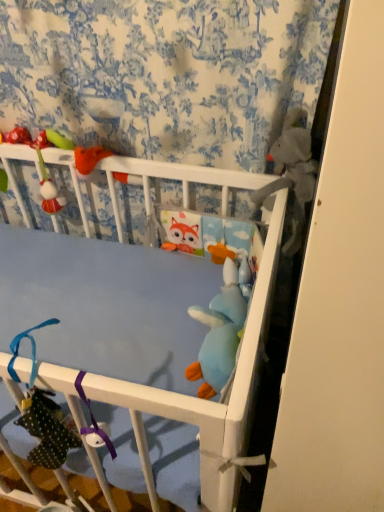
Measure the distance between point [46,141] and camera.

Point [46,141] is 1.09 meters from camera.

What do you see at coordinates (292, 173) in the screenshot? I see `gray plush toy at upper right, marked as the first toy in a right-to-left arrangement` at bounding box center [292, 173].

This screenshot has width=384, height=512. I want to click on fuzzy fabric plush at upper left, the fourth toy positioned from the right, so click(42, 162).

Does blue plush toy at center, which is the 3th toy in left-to-right order, have a greater height compared to fuzzy fabric plush at upper left, which ranks as the first toy in left-to-right order?

In fact, blue plush toy at center, which is the 3th toy in left-to-right order, may be shorter than fuzzy fabric plush at upper left, which ranks as the first toy in left-to-right order.

Is blue plush toy at center, which is the 3th toy in left-to-right order, positioned with its back to fuzzy fabric plush at upper left, which ranks as the first toy in left-to-right order?

No, blue plush toy at center, which is the 3th toy in left-to-right order, is not facing away from fuzzy fabric plush at upper left, which ranks as the first toy in left-to-right order.

Are blue plush toy at center, which is the 3th toy in left-to-right order, and fuzzy fabric plush at upper left, which ranks as the first toy in left-to-right order, located far from each other?

No, blue plush toy at center, which is the 3th toy in left-to-right order, is not far away from fuzzy fabric plush at upper left, which ranks as the first toy in left-to-right order.

Can you confirm if blue plush toy at center, acting as the 2th toy starting from the right, is thinner than fuzzy fabric plush at upper left, the fourth toy positioned from the right?

Yes, blue plush toy at center, acting as the 2th toy starting from the right, is thinner than fuzzy fabric plush at upper left, the fourth toy positioned from the right.

Is gray plush toy at upper right, which ranks as the 4th toy in left-to-right order, wider or thinner than fuzzy fabric plush at upper left, the fourth toy positioned from the right?

In the image, gray plush toy at upper right, which ranks as the 4th toy in left-to-right order, appears to be wider than fuzzy fabric plush at upper left, the fourth toy positioned from the right.

From a real-world perspective, is gray plush toy at upper right, marked as the first toy in a right-to-left arrangement, over fuzzy fabric plush at upper left, the fourth toy positioned from the right?

Yes.

Consider the image. From the image's perspective, which one is positioned lower, gray plush toy at upper right, marked as the first toy in a right-to-left arrangement, or fuzzy fabric plush at upper left, which ranks as the first toy in left-to-right order?

gray plush toy at upper right, marked as the first toy in a right-to-left arrangement, is shown below in the image.

In the scene shown: In terms of height, does gray plush toy at upper right, marked as the first toy in a right-to-left arrangement, look taller or shorter compared to fuzzy fabric plush at upper left, the fourth toy positioned from the right?

In the image, gray plush toy at upper right, marked as the first toy in a right-to-left arrangement, appears to be shorter than fuzzy fabric plush at upper left, the fourth toy positioned from the right.

Is soft blue plush toy at center, the second toy viewed from the left, taller or shorter than blue plush toy at center, acting as the 2th toy starting from the right?

Considering their sizes, soft blue plush toy at center, the second toy viewed from the left, has more height than blue plush toy at center, acting as the 2th toy starting from the right.

Are soft blue plush toy at center, the second toy viewed from the left, and blue plush toy at center, acting as the 2th toy starting from the right, beside each other?

Yes, soft blue plush toy at center, the second toy viewed from the left, is in contact with blue plush toy at center, acting as the 2th toy starting from the right.

Which is more to the right, soft blue plush toy at center, the second toy viewed from the left, or blue plush toy at center, acting as the 2th toy starting from the right?

Positioned to the right is blue plush toy at center, acting as the 2th toy starting from the right.

From a real-world perspective, between soft blue plush toy at center, which appears as the 3th toy when viewed from the right, and fuzzy fabric plush at upper left, which ranks as the first toy in left-to-right order, who is vertically lower?

In real-world perspective, soft blue plush toy at center, which appears as the 3th toy when viewed from the right, is lower.

Between soft blue plush toy at center, which appears as the 3th toy when viewed from the right, and fuzzy fabric plush at upper left, the fourth toy positioned from the right, which one is positioned behind?

fuzzy fabric plush at upper left, the fourth toy positioned from the right.

Between soft blue plush toy at center, the second toy viewed from the left, and fuzzy fabric plush at upper left, the fourth toy positioned from the right, which one has larger width?

Wider between the two is soft blue plush toy at center, the second toy viewed from the left.

Would you say soft blue plush toy at center, the second toy viewed from the left, is to the left or to the right of fuzzy fabric plush at upper left, the fourth toy positioned from the right, in the picture?

soft blue plush toy at center, the second toy viewed from the left, is positioned on fuzzy fabric plush at upper left, the fourth toy positioned from the right,'s right side.

In terms of width, does soft blue plush toy at center, the second toy viewed from the left, look wider or thinner when compared to gray plush toy at upper right, marked as the first toy in a right-to-left arrangement?

In the image, soft blue plush toy at center, the second toy viewed from the left, appears to be wider than gray plush toy at upper right, marked as the first toy in a right-to-left arrangement.

Considering the relative sizes of soft blue plush toy at center, which appears as the 3th toy when viewed from the right, and gray plush toy at upper right, marked as the first toy in a right-to-left arrangement, in the image provided, is soft blue plush toy at center, which appears as the 3th toy when viewed from the right, taller than gray plush toy at upper right, marked as the first toy in a right-to-left arrangement,?

Incorrect, the height of soft blue plush toy at center, which appears as the 3th toy when viewed from the right, is not larger of that of gray plush toy at upper right, marked as the first toy in a right-to-left arrangement.

Which is in front, soft blue plush toy at center, which appears as the 3th toy when viewed from the right, or gray plush toy at upper right, which ranks as the 4th toy in left-to-right order?

soft blue plush toy at center, which appears as the 3th toy when viewed from the right.

From a real-world perspective, between soft blue plush toy at center, the second toy viewed from the left, and gray plush toy at upper right, which ranks as the 4th toy in left-to-right order, who is vertically lower?

In real-world perspective, soft blue plush toy at center, the second toy viewed from the left, is lower.

Can you confirm if gray plush toy at upper right, which ranks as the 4th toy in left-to-right order, is positioned to the right of blue plush toy at center, acting as the 2th toy starting from the right?

Indeed, gray plush toy at upper right, which ranks as the 4th toy in left-to-right order, is positioned on the right side of blue plush toy at center, acting as the 2th toy starting from the right.

This screenshot has height=512, width=384. Find the location of `toy on the right side of blue plush toy at center, acting as the 2th toy starting from the right`. toy on the right side of blue plush toy at center, acting as the 2th toy starting from the right is located at coordinates (292, 173).

Which of these two, gray plush toy at upper right, which ranks as the 4th toy in left-to-right order, or blue plush toy at center, which is the 3th toy in left-to-right order, stands shorter?

blue plush toy at center, which is the 3th toy in left-to-right order.

Based on the photo, what's the angular difference between blue plush toy at center, acting as the 2th toy starting from the right, and soft blue plush toy at center, the second toy viewed from the left,'s facing directions?

4.17 degrees.

Based on the photo, considering the sizes of objects blue plush toy at center, acting as the 2th toy starting from the right, and soft blue plush toy at center, which appears as the 3th toy when viewed from the right, in the image provided, who is bigger, blue plush toy at center, acting as the 2th toy starting from the right, or soft blue plush toy at center, which appears as the 3th toy when viewed from the right,?

soft blue plush toy at center, which appears as the 3th toy when viewed from the right.

Between blue plush toy at center, acting as the 2th toy starting from the right, and soft blue plush toy at center, which appears as the 3th toy when viewed from the right, which one appears on the right side from the viewer's perspective?

Positioned to the right is blue plush toy at center, acting as the 2th toy starting from the right.

Is blue plush toy at center, acting as the 2th toy starting from the right, far from soft blue plush toy at center, the second toy viewed from the left?

No, blue plush toy at center, acting as the 2th toy starting from the right, is not far away from soft blue plush toy at center, the second toy viewed from the left.

What are the coordinates of `toy that is the 2nd one when counting upward from the blue plush toy at center, which is the 3th toy in left-to-right order (from the image's perspective)` in the screenshot? It's located at (42, 162).

Locate an element on the screen. Image resolution: width=384 pixels, height=512 pixels. toy that is the 1st one when counting downward from the fuzzy fabric plush at upper left, which ranks as the first toy in left-to-right order (from the image's perspective) is located at coordinates (292, 173).

Looking at the image, which one is located closer to gray plush toy at upper right, which ranks as the 4th toy in left-to-right order, soft blue plush toy at center, the second toy viewed from the left, or blue plush toy at center, which is the 3th toy in left-to-right order?

blue plush toy at center, which is the 3th toy in left-to-right order, is positioned closer to the anchor gray plush toy at upper right, which ranks as the 4th toy in left-to-right order.

Based on their spatial positions, is fuzzy fabric plush at upper left, which ranks as the first toy in left-to-right order, or gray plush toy at upper right, which ranks as the 4th toy in left-to-right order, closer to soft blue plush toy at center, which appears as the 3th toy when viewed from the right?

gray plush toy at upper right, which ranks as the 4th toy in left-to-right order, is closer to soft blue plush toy at center, which appears as the 3th toy when viewed from the right.

Which object lies nearer to the anchor point blue plush toy at center, which is the 3th toy in left-to-right order, soft blue plush toy at center, the second toy viewed from the left, or gray plush toy at upper right, marked as the first toy in a right-to-left arrangement?

soft blue plush toy at center, the second toy viewed from the left, is positioned closer to the anchor blue plush toy at center, which is the 3th toy in left-to-right order.

In the scene shown: From the image, which object appears to be farther from fuzzy fabric plush at upper left, the fourth toy positioned from the right, soft blue plush toy at center, the second toy viewed from the left, or gray plush toy at upper right, marked as the first toy in a right-to-left arrangement?

soft blue plush toy at center, the second toy viewed from the left.

Considering their positions, is gray plush toy at upper right, which ranks as the 4th toy in left-to-right order, positioned closer to fuzzy fabric plush at upper left, which ranks as the first toy in left-to-right order, than soft blue plush toy at center, the second toy viewed from the left?

gray plush toy at upper right, which ranks as the 4th toy in left-to-right order, is closer to fuzzy fabric plush at upper left, which ranks as the first toy in left-to-right order.

When comparing their distances from gray plush toy at upper right, marked as the first toy in a right-to-left arrangement, does soft blue plush toy at center, the second toy viewed from the left, or fuzzy fabric plush at upper left, the fourth toy positioned from the right, seem closer?

soft blue plush toy at center, the second toy viewed from the left, lies closer to gray plush toy at upper right, marked as the first toy in a right-to-left arrangement, than the other object.

Considering their positions, is soft blue plush toy at center, the second toy viewed from the left, positioned closer to blue plush toy at center, acting as the 2th toy starting from the right, than fuzzy fabric plush at upper left, which ranks as the first toy in left-to-right order?

soft blue plush toy at center, the second toy viewed from the left, is positioned closer to the anchor blue plush toy at center, acting as the 2th toy starting from the right.

Which object lies nearer to the anchor point soft blue plush toy at center, the second toy viewed from the left, blue plush toy at center, which is the 3th toy in left-to-right order, or gray plush toy at upper right, which ranks as the 4th toy in left-to-right order?

blue plush toy at center, which is the 3th toy in left-to-right order, is positioned closer to the anchor soft blue plush toy at center, the second toy viewed from the left.

Identify the location of toy between gray plush toy at upper right, which ranks as the 4th toy in left-to-right order, and soft blue plush toy at center, the second toy viewed from the left, from top to bottom. (234, 264).

Find the location of `toy between fuzzy fabric plush at upper left, which ranks as the first toy in left-to-right order, and blue plush toy at center, acting as the 2th toy starting from the right, from left to right`. toy between fuzzy fabric plush at upper left, which ranks as the first toy in left-to-right order, and blue plush toy at center, acting as the 2th toy starting from the right, from left to right is located at coordinates (221, 330).